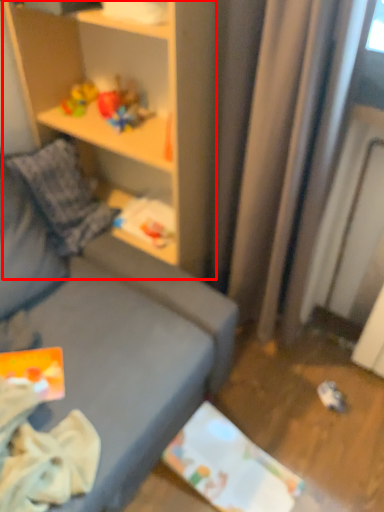
Question: From the image's perspective, where is shelf (annotated by the red box) located relative to toy?

Choices:
 (A) above
 (B) below

Answer: (B)